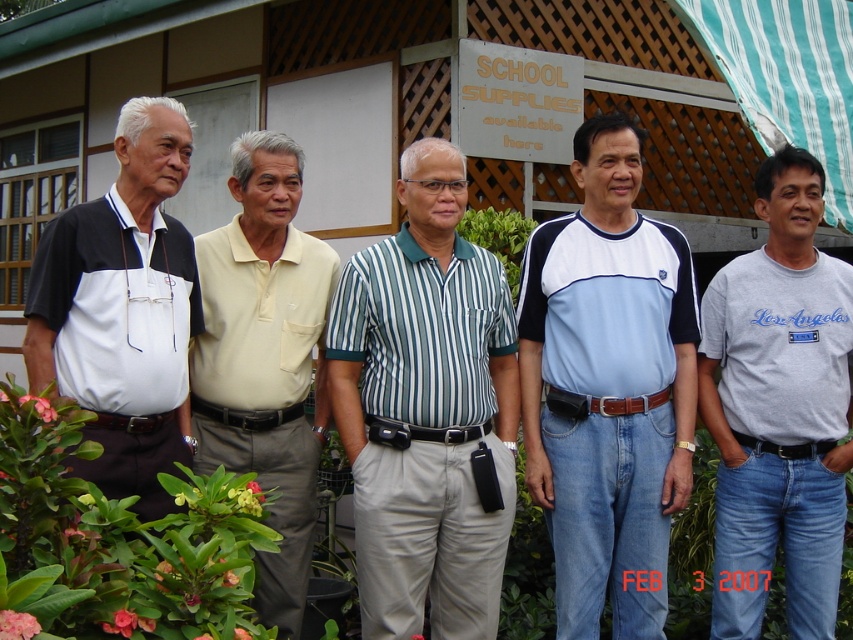
Question: Which of these objects is positioned closest to the light yellow polo shirt at center?

Choices:
 (A) matte black polo shirt at left
 (B) gray cotton t-shirt at right
 (C) light blue jersey at center

Answer: (A)

Question: Considering the relative positions of green striped shirt at center and matte black polo shirt at left in the image provided, where is green striped shirt at center located with respect to matte black polo shirt at left?

Choices:
 (A) left
 (B) right

Answer: (B)

Question: Among these points, which one is nearest to the camera?

Choices:
 (A) (761, 534)
 (B) (433, 499)
 (C) (640, 570)
 (D) (193, 468)

Answer: (D)

Question: Is light blue jersey at center thinner than light yellow polo shirt at center?

Choices:
 (A) yes
 (B) no

Answer: (B)

Question: Can you confirm if green striped shirt at center is positioned to the right of light yellow polo shirt at center?

Choices:
 (A) yes
 (B) no

Answer: (A)

Question: Among these points, which one is farthest from the camera?

Choices:
 (A) click(402, 616)
 (B) click(555, 365)
 (C) click(335, 276)
 (D) click(169, 145)

Answer: (C)